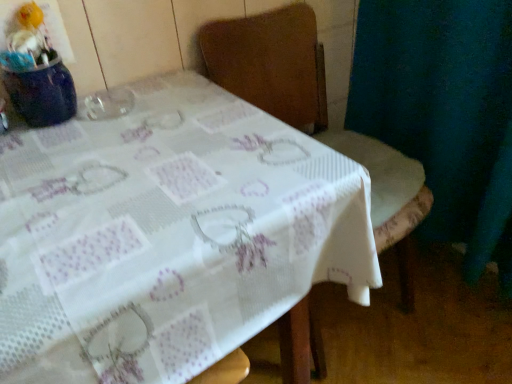
Question: Is wooden chair at center taller or shorter than white printed fabric at center?

Choices:
 (A) short
 (B) tall

Answer: (B)

Question: Looking at their shapes, would you say wooden chair at center is wider or thinner than white printed fabric at center?

Choices:
 (A) thin
 (B) wide

Answer: (A)

Question: Considering their positions, is wooden chair at center located in front of or behind white printed fabric at center?

Choices:
 (A) behind
 (B) front

Answer: (A)

Question: From the image's perspective, is white printed fabric at center positioned above or below wooden chair at center?

Choices:
 (A) below
 (B) above

Answer: (A)

Question: Considering their positions, is white printed fabric at center located in front of or behind wooden chair at center?

Choices:
 (A) behind
 (B) front

Answer: (B)

Question: Is white printed fabric at center taller or shorter than wooden chair at center?

Choices:
 (A) tall
 (B) short

Answer: (B)

Question: Is white printed fabric at center spatially inside wooden chair at center, or outside of it?

Choices:
 (A) inside
 (B) outside

Answer: (B)